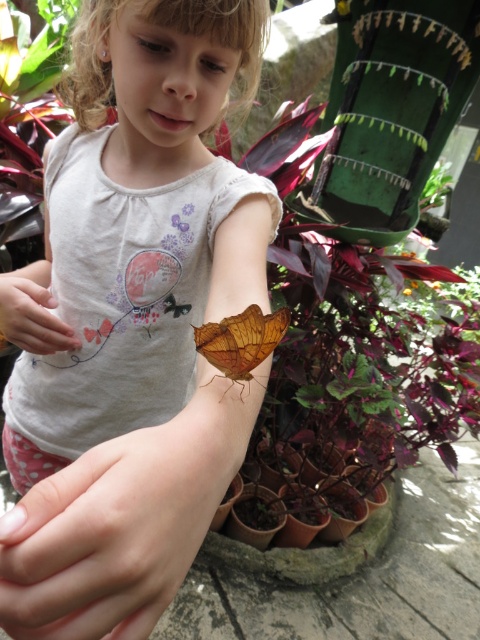
Question: In this image, where is smooth skin at lower center located relative to matte skin hand at center?

Choices:
 (A) above
 (B) below

Answer: (B)

Question: Does matte orange butterfly at upper right appear on the left side of smooth skin at lower center?

Choices:
 (A) yes
 (B) no

Answer: (A)

Question: Which point is closer to the camera?

Choices:
 (A) brown matte butterfly at center
 (B) matte skin hand at center

Answer: (A)

Question: Estimate the real-world distances between objects in this image. Which object is closer to the matte orange butterfly at upper right?

Choices:
 (A) green leafy plant at upper center
 (B) matte skin hand at center

Answer: (B)

Question: Is smooth skin at lower center bigger than matte skin hand at center?

Choices:
 (A) yes
 (B) no

Answer: (B)

Question: Which of the following is the farthest from the observer?

Choices:
 (A) (444, 168)
 (B) (6, 280)
 (C) (168, 154)
 (D) (40, 508)

Answer: (A)